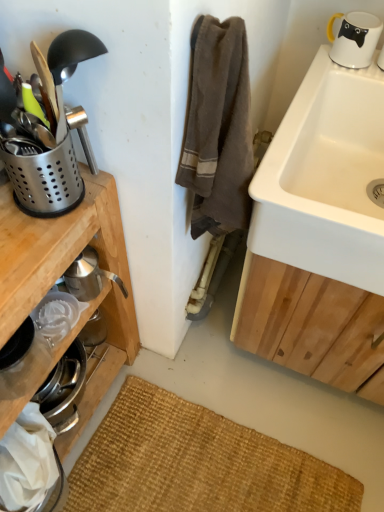
You are a GUI agent. You are given a task and a screenshot of the screen. Output one action in this format:
    pyautogui.click(x=<x>, y=<y>)
    Task: Click on the free space in front of white glossy mug at upper right
    This screenshot has width=384, height=512.
    Given the screenshot: What is the action you would take?
    pyautogui.click(x=336, y=74)